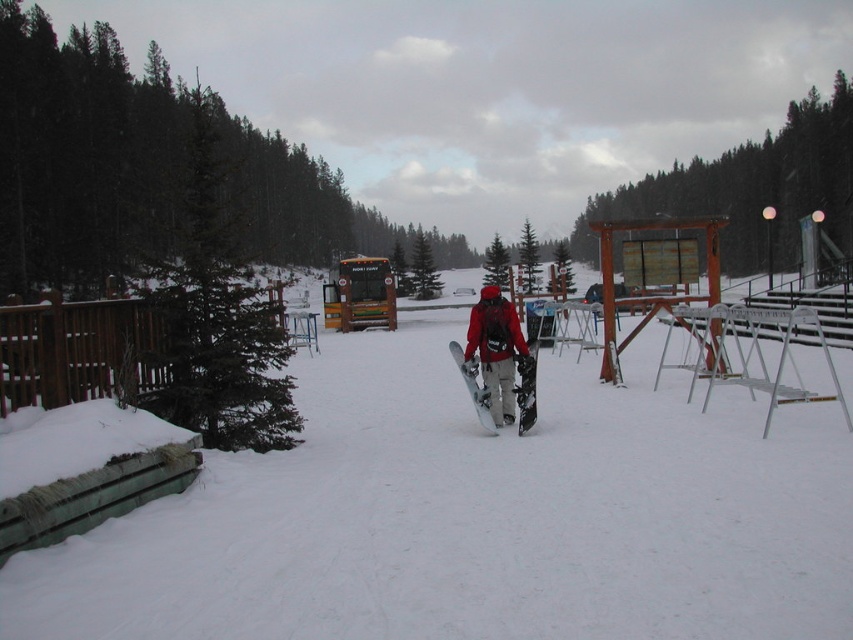
Question: Is matte red snowboarder at center wider than white matte snowboard at center?

Choices:
 (A) no
 (B) yes

Answer: (B)

Question: Which of the following is the farthest from the observer?

Choices:
 (A) (527, 301)
 (B) (775, 512)
 (C) (473, 348)

Answer: (A)

Question: Is the position of matte red snowboarder at center more distant than that of white matte snowboard at center?

Choices:
 (A) yes
 (B) no

Answer: (A)

Question: Which object appears farthest from the camera in this image?

Choices:
 (A) white matte snow at center
 (B) white matte snowboard at center
 (C) matte red snowboarder at center
 (D) yellow-green painted school bus at center

Answer: (D)

Question: Which of the following is the closest to the observer?

Choices:
 (A) matte red snowboarder at center
 (B) yellow-green painted school bus at center
 (C) black matte snowboard at center

Answer: (C)

Question: Is the position of white matte snow at center less distant than that of white matte snowboard at center?

Choices:
 (A) no
 (B) yes

Answer: (B)